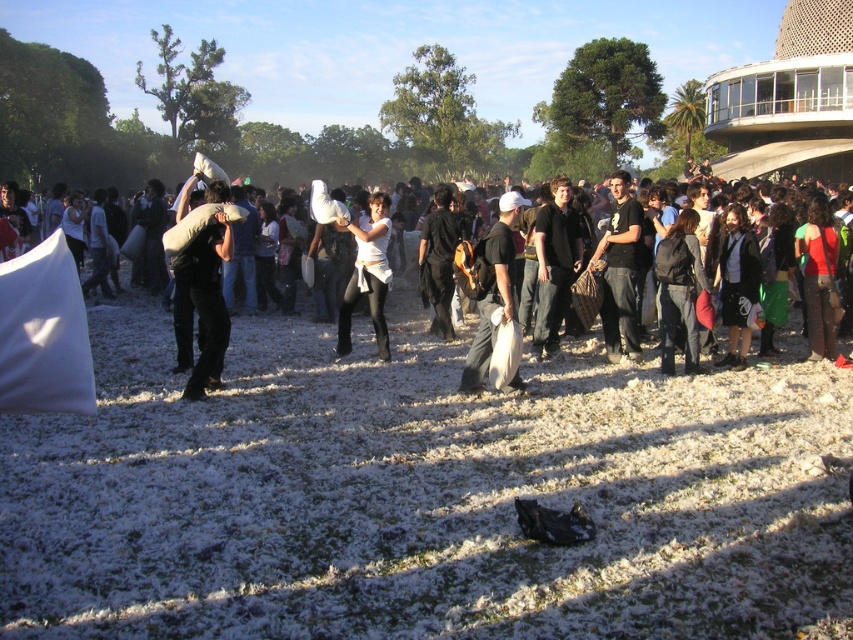
Looking at this image, you are organizing an outdoor event and need to place a black leather jacket at center and a white cotton pillow at left. Given their sizes, which item would require more space to display properly?

The white cotton pillow at left requires more space to display properly because it is larger than the black leather jacket at center.

You are standing at the center of the park and see the dark brown leather jacket at center. If you walk straight ahead, will you step on the shredded paper or the grass?

Since the dark brown leather jacket at center is positioned at point (554, 264), which is near the center of the image, walking straight ahead from the center would lead you towards the shredded paper and grass area. However, the shredded paper is scattered across the green grass, so you might step on both depending on the exact path. But since the jacket is at center, the shredded paper is likely underfoot as it covers the ground around the center area.